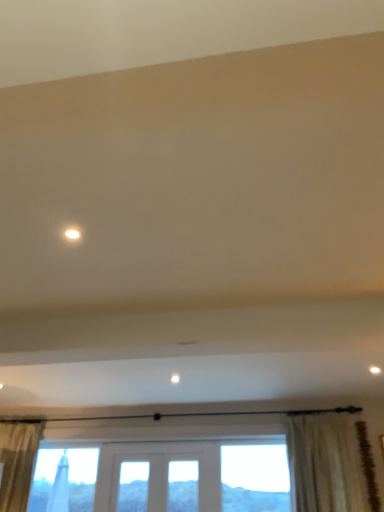
Question: Can you confirm if white textured curtain at lower right is positioned to the right of matte white light at upper center?

Choices:
 (A) no
 (B) yes

Answer: (B)

Question: Does white textured curtain at lower right have a lesser width compared to matte white light at upper center?

Choices:
 (A) yes
 (B) no

Answer: (B)

Question: Considering the relative sizes of white textured curtain at lower right and matte white light at upper center in the image provided, is white textured curtain at lower right shorter than matte white light at upper center?

Choices:
 (A) no
 (B) yes

Answer: (A)

Question: Does white textured curtain at lower right appear on the left side of matte white light at upper center?

Choices:
 (A) yes
 (B) no

Answer: (B)

Question: Does white textured curtain at lower right come in front of matte white light at upper center?

Choices:
 (A) yes
 (B) no

Answer: (B)

Question: Does white textured curtain at lower right have a smaller size compared to matte white light at upper center?

Choices:
 (A) no
 (B) yes

Answer: (A)

Question: Is matte white light at upper center oriented towards white textured curtain at lower right?

Choices:
 (A) yes
 (B) no

Answer: (B)

Question: Does matte white light at upper center appear on the left side of white textured curtain at lower right?

Choices:
 (A) yes
 (B) no

Answer: (A)

Question: Is the depth of matte white light at upper center less than that of white textured curtain at lower right?

Choices:
 (A) no
 (B) yes

Answer: (B)

Question: Considering the relative sizes of matte white light at upper center and white textured curtain at lower right in the image provided, is matte white light at upper center bigger than white textured curtain at lower right?

Choices:
 (A) no
 (B) yes

Answer: (A)

Question: From a real-world perspective, is matte white light at upper center on white textured curtain at lower right?

Choices:
 (A) yes
 (B) no

Answer: (A)

Question: From the image's perspective, is matte white light at upper center under white textured curtain at lower right?

Choices:
 (A) yes
 (B) no

Answer: (B)

Question: In terms of height, does white textured curtain at lower right look taller or shorter compared to matte white light at upper center?

Choices:
 (A) short
 (B) tall

Answer: (B)